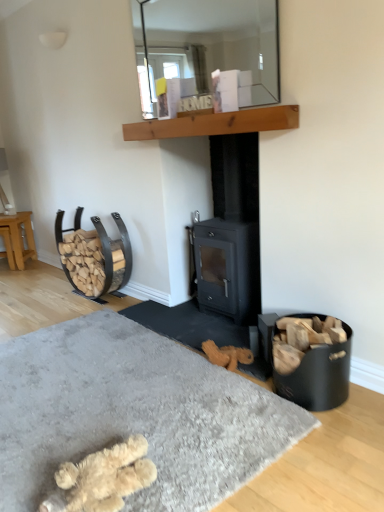
Question: From a real-world perspective, is light brown wooden stool at left physically below clear glass mirror at upper center?

Choices:
 (A) yes
 (B) no

Answer: (A)

Question: Can you confirm if light brown wooden stool at left is positioned to the right of clear glass mirror at upper center?

Choices:
 (A) no
 (B) yes

Answer: (A)

Question: Can you confirm if light brown wooden stool at left is thinner than clear glass mirror at upper center?

Choices:
 (A) no
 (B) yes

Answer: (A)

Question: Considering the relative sizes of light brown wooden stool at left and clear glass mirror at upper center in the image provided, is light brown wooden stool at left wider than clear glass mirror at upper center?

Choices:
 (A) yes
 (B) no

Answer: (A)

Question: Are light brown wooden stool at left and clear glass mirror at upper center far apart?

Choices:
 (A) no
 (B) yes

Answer: (B)

Question: Is wooden at upper center to the left or to the right of clear glass mirror at upper center in the image?

Choices:
 (A) left
 (B) right

Answer: (A)

Question: From their relative heights in the image, would you say wooden at upper center is taller or shorter than clear glass mirror at upper center?

Choices:
 (A) short
 (B) tall

Answer: (A)

Question: Is wooden at upper center inside or outside of clear glass mirror at upper center?

Choices:
 (A) outside
 (B) inside

Answer: (A)

Question: In terms of size, does wooden at upper center appear bigger or smaller than clear glass mirror at upper center?

Choices:
 (A) big
 (B) small

Answer: (B)

Question: In the image, is fuzzy beige slippers at lower left positioned in front of or behind fluffy beige slippers at lower center?

Choices:
 (A) behind
 (B) front

Answer: (A)

Question: Considering the positions of fuzzy beige slippers at lower left and fluffy beige slippers at lower center in the image, is fuzzy beige slippers at lower left taller or shorter than fluffy beige slippers at lower center?

Choices:
 (A) tall
 (B) short

Answer: (A)

Question: In terms of width, does fuzzy beige slippers at lower left look wider or thinner when compared to fluffy beige slippers at lower center?

Choices:
 (A) thin
 (B) wide

Answer: (A)

Question: Considering the positions of point (102, 510) and point (200, 454), is point (102, 510) closer or farther from the camera than point (200, 454)?

Choices:
 (A) farther
 (B) closer

Answer: (B)

Question: Considering the relative positions of fuzzy beige slippers at lower left and light brown wooden stool at left in the image provided, is fuzzy beige slippers at lower left to the left or to the right of light brown wooden stool at left?

Choices:
 (A) left
 (B) right

Answer: (B)

Question: From the image's perspective, is fuzzy beige slippers at lower left located above or below light brown wooden stool at left?

Choices:
 (A) above
 (B) below

Answer: (B)